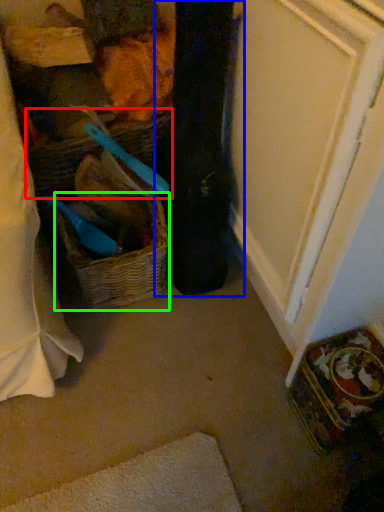
Question: Estimate the real-world distances between objects in this image. Which object is farther from basket (highlighted by a red box), clothing (highlighted by a blue box) or picnic basket (highlighted by a green box)?

Choices:
 (A) clothing
 (B) picnic basket

Answer: (A)